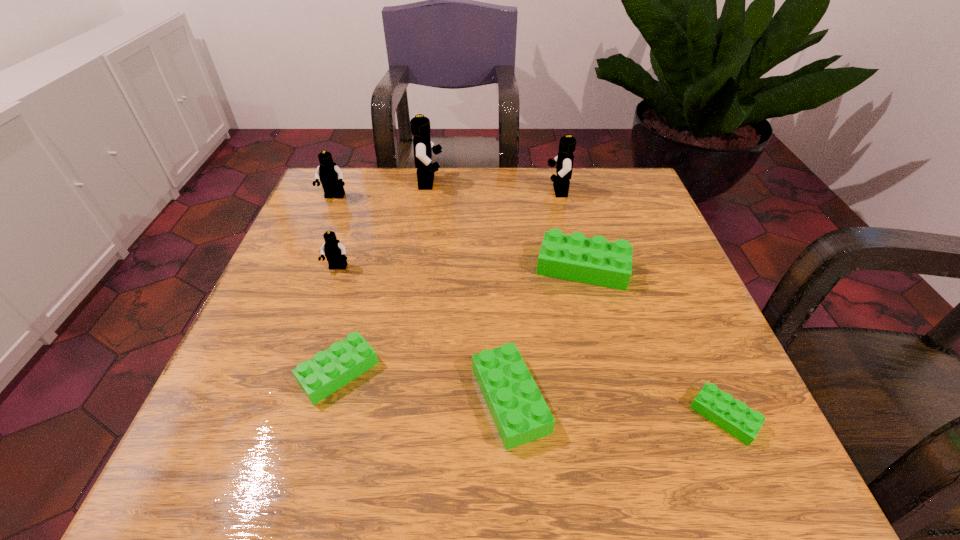
This screenshot has width=960, height=540. I want to click on free spot between the third green Lego from left to right and the nearest black Lego, so click(x=460, y=268).

Locate an element on the screen. This screenshot has height=540, width=960. free space between the second shortest object and the second smallest black Lego is located at coordinates (336, 285).

Select which object appears as the fourth closest to the third smallest black Lego. Please provide its 2D coordinates. Your answer should be formatted as a tuple, i.e. [(x, y)], where the tuple contains the x and y coordinates of a point satisfying the conditions above.

[(334, 251)]

Identify the location of object that stands as the third closest to the smallest green Lego. Image resolution: width=960 pixels, height=540 pixels. (329, 370).

Identify which Lego is located as the second nearest to the fifth tallest Lego. Please provide its 2D coordinates. Your answer should be formatted as a tuple, i.e. [(x, y)], where the tuple contains the x and y coordinates of a point satisfying the conditions above.

[(564, 166)]

The width and height of the screenshot is (960, 540). I want to click on Lego that stands as the fourth closest to the fifth object from left to right, so click(x=334, y=251).

Find the location of `black Lego that is the closest to the rightmost object`. black Lego that is the closest to the rightmost object is located at coordinates (564, 166).

Where is `black Lego identified as the third closest to the rightmost object`? This screenshot has width=960, height=540. black Lego identified as the third closest to the rightmost object is located at coordinates (420, 125).

Choose which green Lego is the second nearest neighbor to the smallest green Lego. Please provide its 2D coordinates. Your answer should be formatted as a tuple, i.e. [(x, y)], where the tuple contains the x and y coordinates of a point satisfying the conditions above.

[(595, 261)]

Locate an element on the screen. green Lego that stands as the third closest to the fifth shortest Lego is located at coordinates (595, 261).